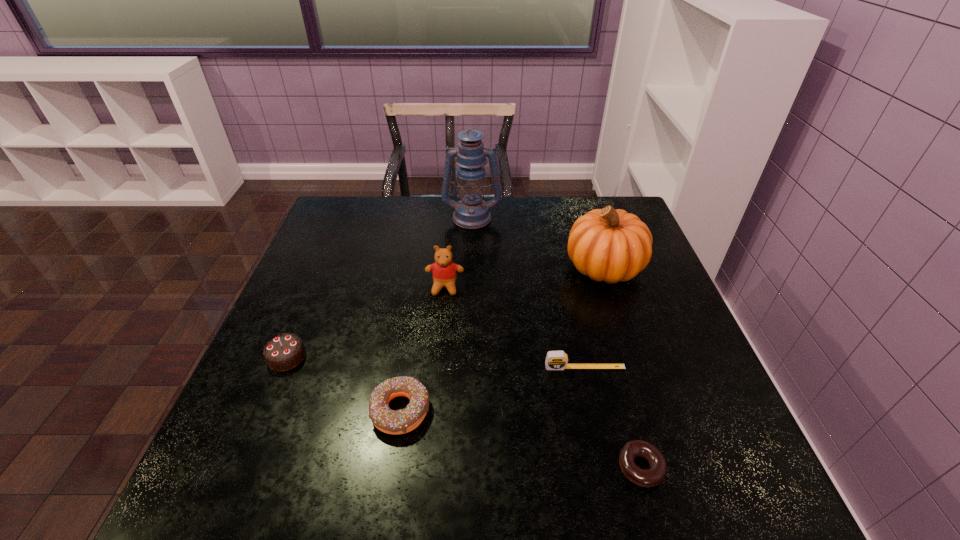
You are a GUI agent. You are given a task and a screenshot of the screen. Output one action in this format:
    pyautogui.click(x=<x>, y=<y>)
    Task: Click on the right doughnut
    The height and width of the screenshot is (540, 960).
    Given the screenshot: What is the action you would take?
    pyautogui.click(x=654, y=475)

You are a GUI agent. You are given a task and a screenshot of the screen. Output one action in this format:
    pyautogui.click(x=<x>, y=<y>)
    Task: Click on the free space located on the front-facing side of the lantern
    This screenshot has width=960, height=540.
    Given the screenshot: What is the action you would take?
    pyautogui.click(x=470, y=270)

Locate an element on the screen. free spot located on the left of the sixth shortest object is located at coordinates (497, 267).

You are a GUI agent. You are given a task and a screenshot of the screen. Output one action in this format:
    pyautogui.click(x=<x>, y=<y>)
    Task: Click on the free space located on the front-facing side of the third tallest object
    The image size is (960, 540).
    Given the screenshot: What is the action you would take?
    pyautogui.click(x=437, y=373)

Locate an element on the screen. The width and height of the screenshot is (960, 540). free spot located 0.360m on the back of the chocolate cake is located at coordinates (333, 246).

Find the location of `free space located on the back of the left doughnut`. free space located on the back of the left doughnut is located at coordinates (420, 289).

I want to click on vacant area situated at the front of the tape measure with the tape extended, so click(605, 458).

Find the location of a particular element. Image resolution: width=960 pixels, height=540 pixels. vacant space located 0.180m on the left of the shortest object is located at coordinates (516, 467).

Locate an element on the screen. The image size is (960, 540). object that is at the far edge is located at coordinates (472, 212).

Find the location of a particular element. The image size is (960, 540). object located at the near edge is located at coordinates (654, 475).